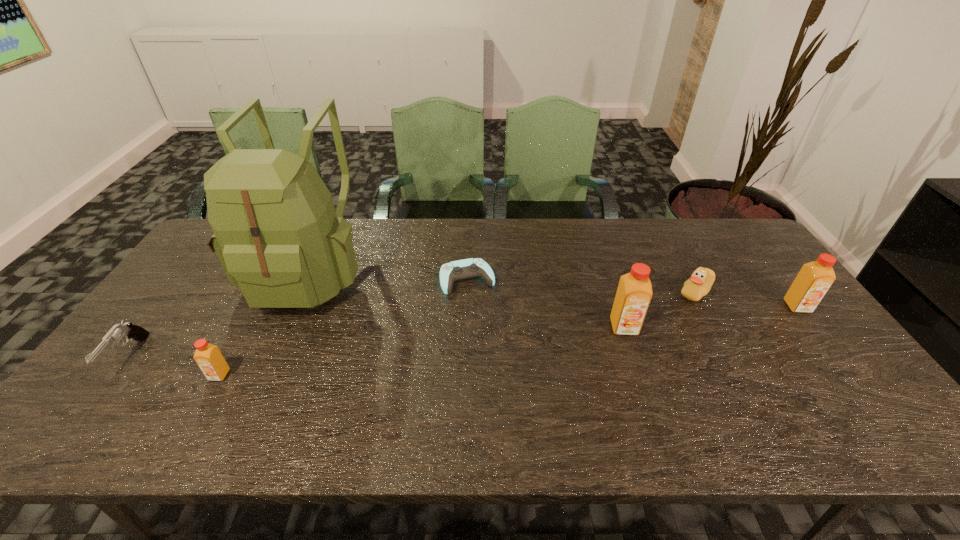
At what (x,y) coordinates should I click in order to perform the action: click on gun. Please return your answer as a coordinate pair (x, y). The height and width of the screenshot is (540, 960). Looking at the image, I should click on (127, 330).

Locate an element on the screen. The width and height of the screenshot is (960, 540). vacant region located on the front and back of the second nearest orange juice is located at coordinates (647, 399).

Find the location of a particular element. This screenshot has width=960, height=540. free space located on the front and back of the farthest orange juice is located at coordinates (828, 347).

This screenshot has height=540, width=960. Find the location of `free space located on the front pocket of the backpack`. free space located on the front pocket of the backpack is located at coordinates (274, 349).

Identify the location of vacant space situated 0.350m at the beak of the duck. The image size is (960, 540). (560, 292).

Find the location of a particular element. The height and width of the screenshot is (540, 960). vacant space located 0.180m at the beak of the duck is located at coordinates (616, 292).

This screenshot has height=540, width=960. I want to click on blank space located at the beak of the duck, so click(634, 292).

Locate an element on the screen. The width and height of the screenshot is (960, 540). vacant space located on the front of the control is located at coordinates (467, 319).

Image resolution: width=960 pixels, height=540 pixels. What are the coordinates of `object that is positioned at the far edge` in the screenshot? It's located at (277, 236).

Identify the location of orange juice that is positioned at the near edge. The width and height of the screenshot is (960, 540). (208, 357).